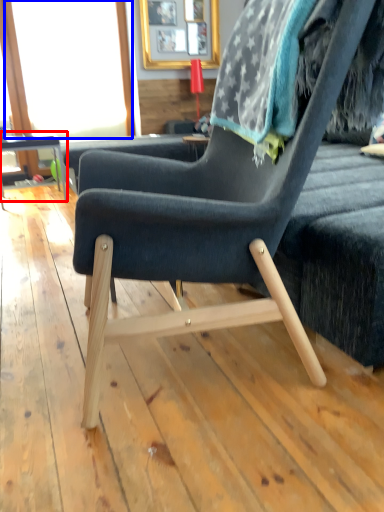
Question: Among these objects, which one is farthest to the camera, table (highlighted by a red box) or window screen (highlighted by a blue box)?

Choices:
 (A) table
 (B) window screen

Answer: (B)